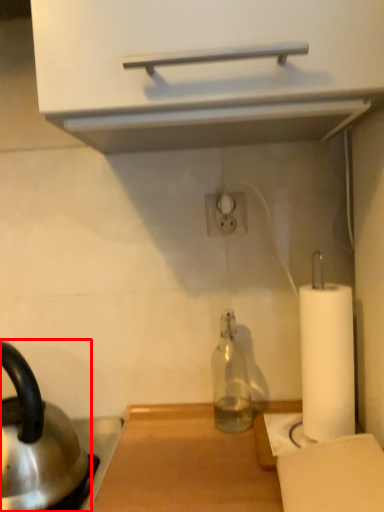
Question: Considering the relative positions of kettle (annotated by the red box) and bottle in the image provided, where is kettle (annotated by the red box) located with respect to the staircase?

Choices:
 (A) left
 (B) right

Answer: (A)